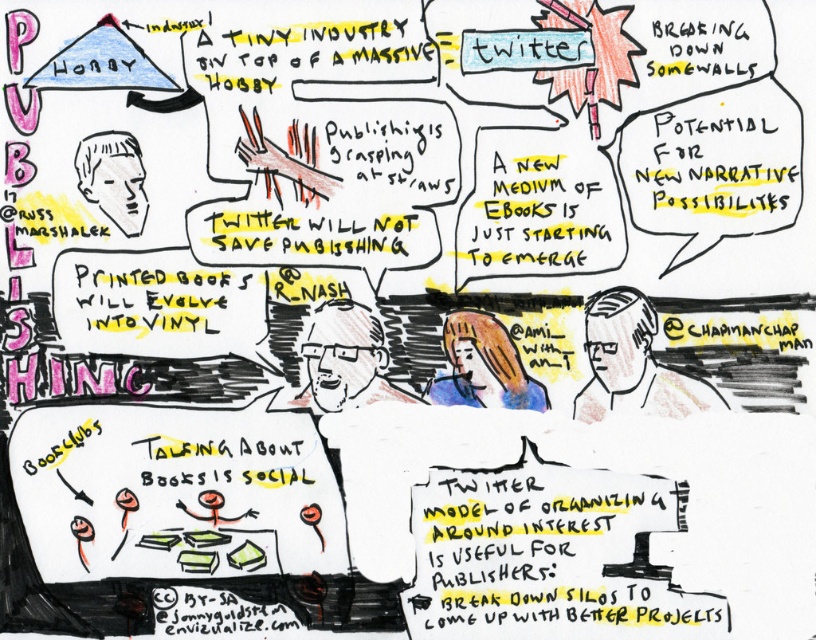
Question: Can you confirm if gray textured shirt at center right is smaller than gray textured face at center?

Choices:
 (A) no
 (B) yes

Answer: (A)

Question: In this image, where is gray textured shirt at center right located relative to blue fabric face at center?

Choices:
 (A) left
 (B) right

Answer: (B)

Question: Which object appears farthest from the camera in this image?

Choices:
 (A) blue fabric face at center
 (B) light brown paper at upper left

Answer: (A)

Question: Which object is the farthest from the gray textured shirt at center right?

Choices:
 (A) light brown paper at upper left
 (B) gray textured face at center

Answer: (A)

Question: Estimate the real-world distances between objects in this image. Which object is closer to the yellow paper text at center?

Choices:
 (A) gray textured shirt at center right
 (B) blue fabric face at center
 (C) gray textured face at center

Answer: (A)

Question: Can you confirm if gray textured shirt at center right is positioned below light brown paper at upper left?

Choices:
 (A) no
 (B) yes

Answer: (B)